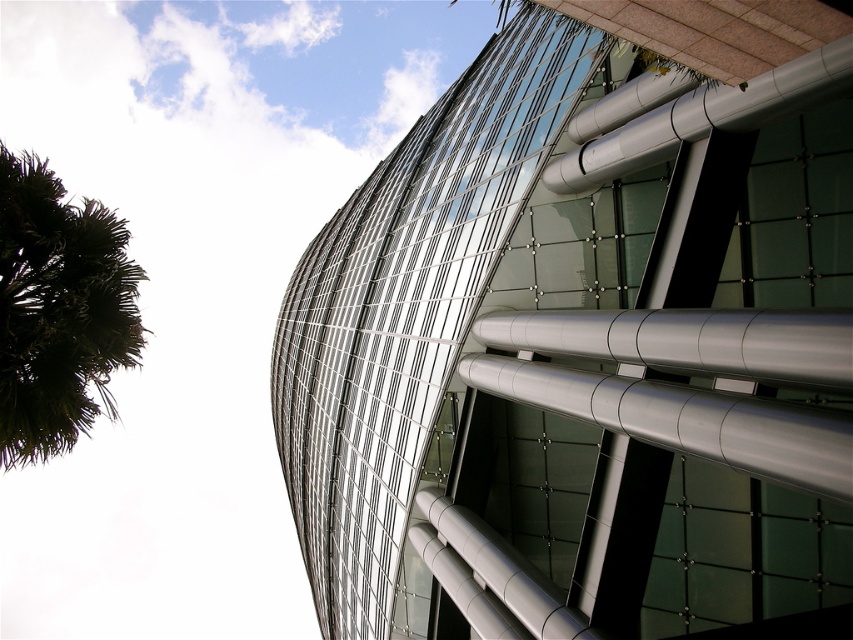
You are standing in front of the transparent glass building at upper center and the green leafy palm tree at left. Which object is positioned more to the east if the sun is setting in the west?

The transparent glass building at upper center is positioned more to the east because it is to the right of the green leafy palm tree at left, and since the sun is setting in the west, the right side would face east.

You are standing at the base of the transparent glass building at upper center and want to take a photo of the green leafy palm tree at left. Will the palm tree be fully visible in the photo if you position yourself directly in front of the building?

The transparent glass building at upper center might be wider than the green leafy palm tree at left, so there is a possibility that part of the palm tree could be obscured if the building extends beyond the tree in width. To ensure full visibility, you might need to adjust your position to the side.